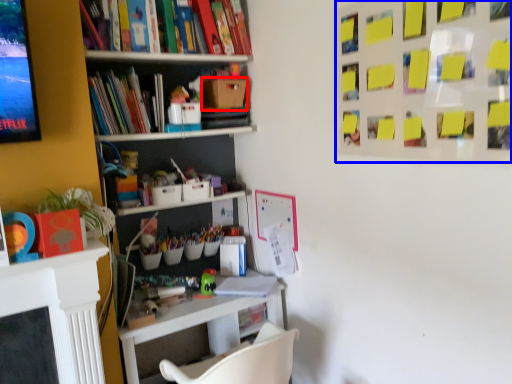
Question: Which of the following is the farthest to the observer, cardboard box (highlighted by a red box) or bulletin board (highlighted by a blue box)?

Choices:
 (A) cardboard box
 (B) bulletin board

Answer: (A)